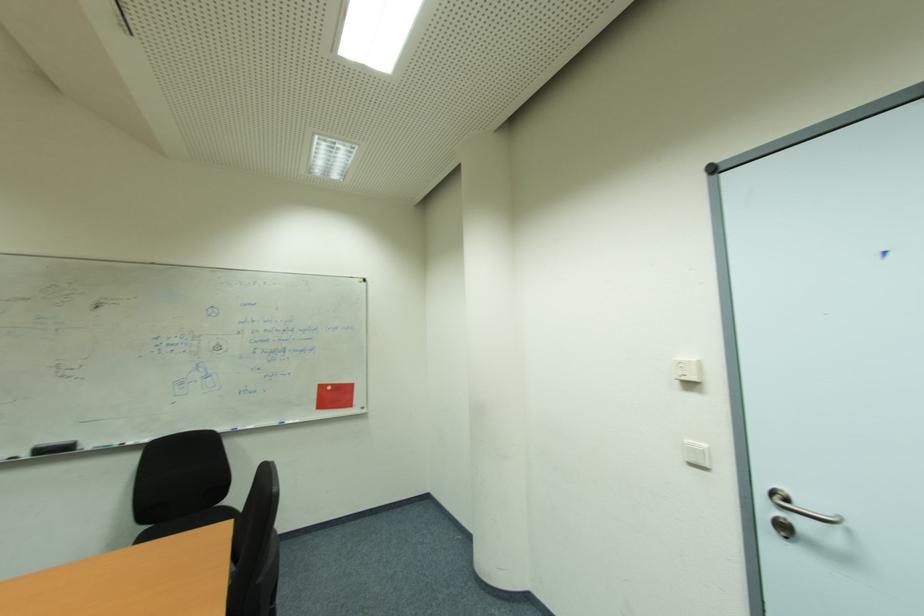
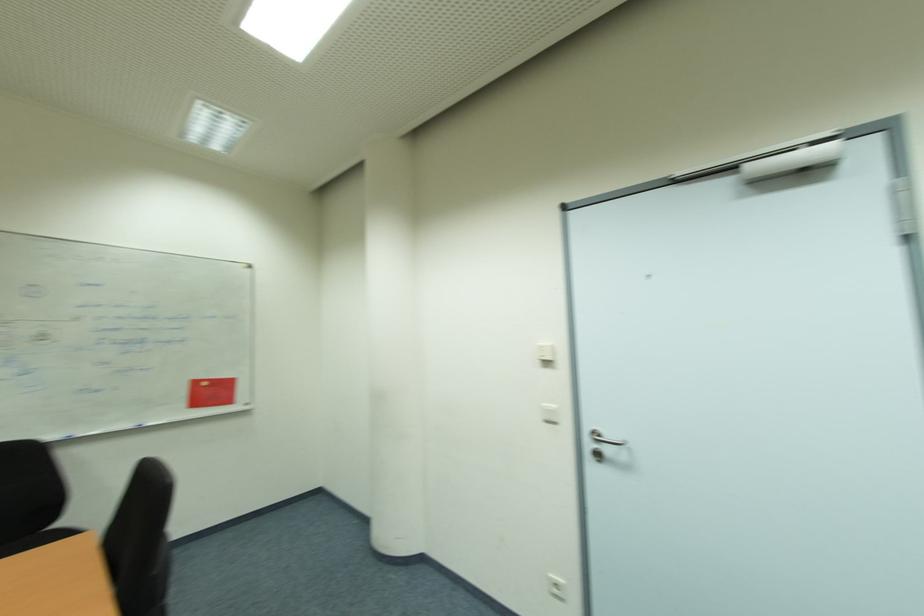
What movement of the cameraman would produce the second image?

The cameraman moved toward left, backward.